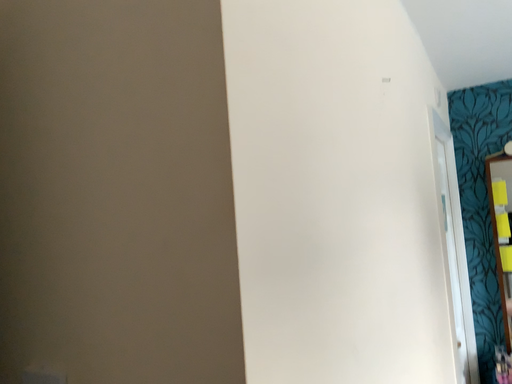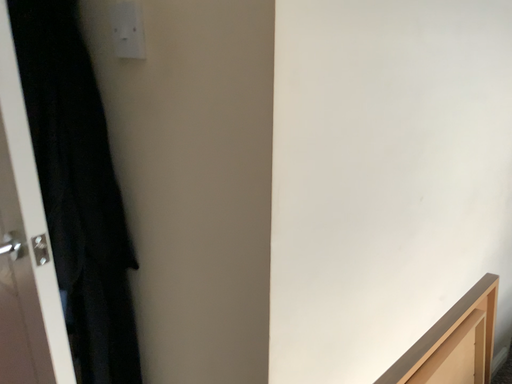
Question: How did the camera likely rotate when shooting the video?

Choices:
 (A) rotated upward
 (B) rotated downward

Answer: (B)